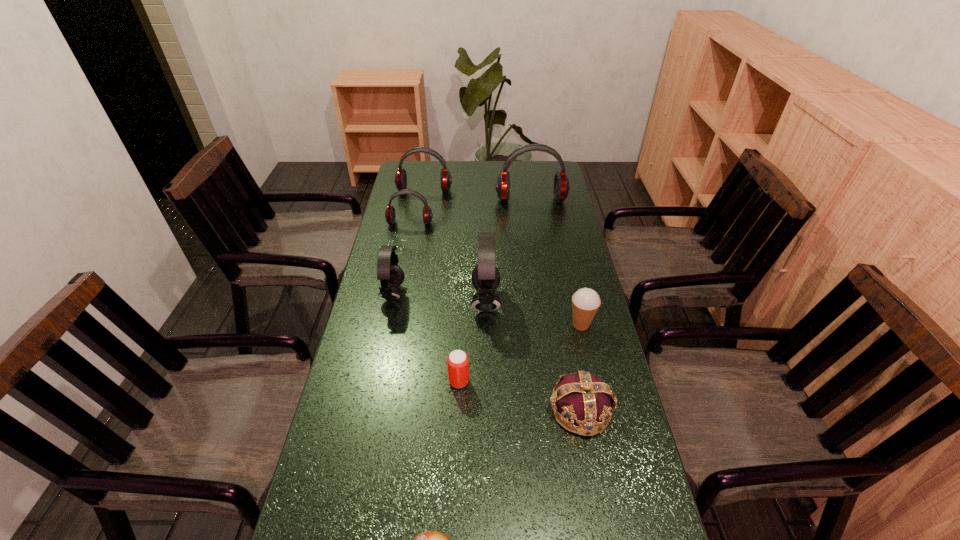
Where is `earphone located at the right edge`? The image size is (960, 540). earphone located at the right edge is located at coordinates (561, 181).

Where is `icecream located at the right edge`? The image size is (960, 540). icecream located at the right edge is located at coordinates (585, 302).

Find the location of a particular element. The width and height of the screenshot is (960, 540). crown located at the right edge is located at coordinates (583, 398).

Locate an element on the screen. The height and width of the screenshot is (540, 960). object at the far left corner is located at coordinates (400, 179).

This screenshot has height=540, width=960. In the image, there is a desktop. Find the location of `vacant space at the far edge`. vacant space at the far edge is located at coordinates (480, 179).

Identify the location of free space at the left edge. (363, 364).

Find the location of a particular element. This screenshot has width=960, height=540. free space at the right edge of the desktop is located at coordinates (576, 242).

Where is `vacant space at the far left corner of the desktop`? vacant space at the far left corner of the desktop is located at coordinates (419, 173).

In the image, there is a desktop. Where is `free region at the far right corner`? free region at the far right corner is located at coordinates (550, 175).

I want to click on free space between the second biggest red earphone and the right black earphone, so (455, 246).